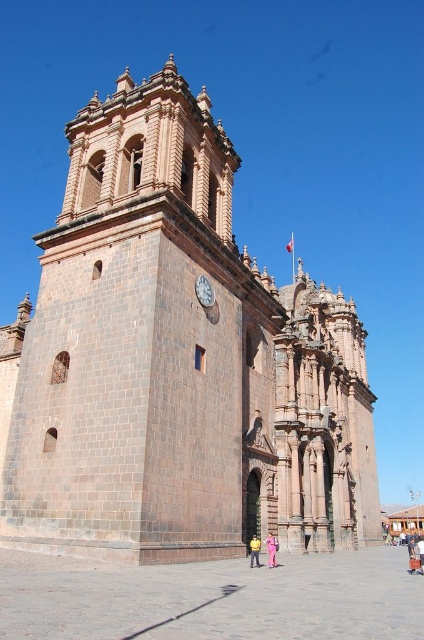
Question: Which point is farther to the camera?

Choices:
 (A) brown stone church at center
 (B) yellow fabric person at lower center

Answer: (B)

Question: Does brown stone church at center appear on the right side of pink fabric person at center?

Choices:
 (A) yes
 (B) no

Answer: (A)

Question: Does matte stone clock at center appear on the right side of yellow fabric person at lower center?

Choices:
 (A) no
 (B) yes

Answer: (A)

Question: In this image, where is matte stone clock at center located relative to yellow fabric person at lower center?

Choices:
 (A) right
 (B) left

Answer: (B)

Question: Which point is farther from the camera taking this photo?

Choices:
 (A) 195,284
 (B) 268,554
 (C) 254,557
 (D) 161,148

Answer: (D)

Question: Estimate the real-world distances between objects in this image. Which object is farther from the pink fabric person at center?

Choices:
 (A) matte stone clock at center
 (B) yellow fabric person at lower center
 (C) brown stone church at center

Answer: (C)